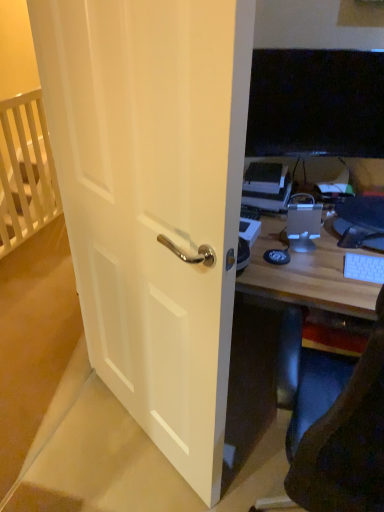
The image size is (384, 512). Find the location of `free spot below white wooden crib at upper left (from a real-world perspective)`. free spot below white wooden crib at upper left (from a real-world perspective) is located at coordinates (45, 226).